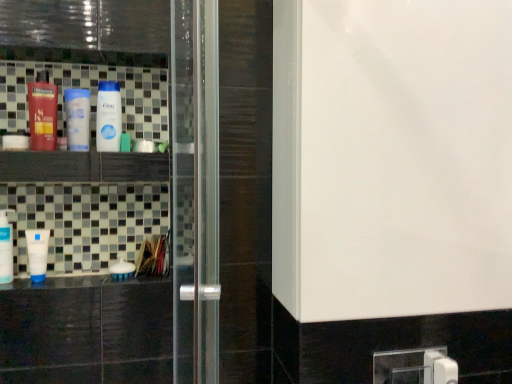
Where is `vacant area situated to the left side of white matte bottle at center, positioned as the 1th bottle in right-to-left order`? vacant area situated to the left side of white matte bottle at center, positioned as the 1th bottle in right-to-left order is located at coordinates (75, 279).